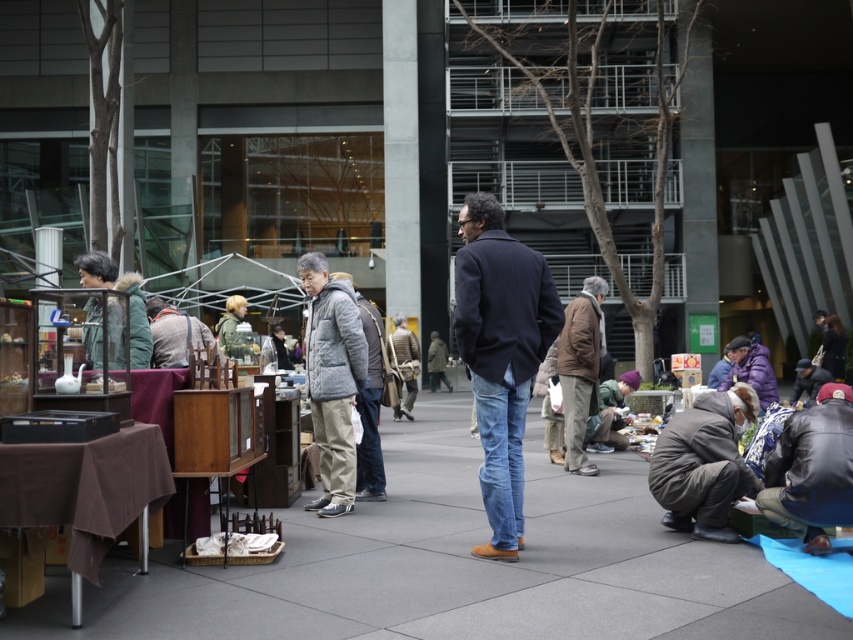
Question: Which of the following is the farthest from the observer?

Choices:
 (A) gray woolen jacket at center
 (B) gray puffer jacket at center
 (C) leather jacket at lower right

Answer: (A)

Question: Which object is farther from the camera taking this photo?

Choices:
 (A) gray woolen jacket at center
 (B) gray wool jacket at center

Answer: (A)

Question: Does dark blue wool coat at center appear under brown cotton jacket at center?

Choices:
 (A) yes
 (B) no

Answer: (B)

Question: Does smooth concrete pavement at center have a larger size compared to gray puffer jacket at center?

Choices:
 (A) no
 (B) yes

Answer: (B)

Question: Which point is farther to the camera?

Choices:
 (A) brown cotton jacket at center
 (B) gray wool jacket at center
 (C) smooth concrete pavement at center

Answer: (A)

Question: Can you confirm if dark blue wool coat at center is thinner than brown cotton jacket at center?

Choices:
 (A) yes
 (B) no

Answer: (B)